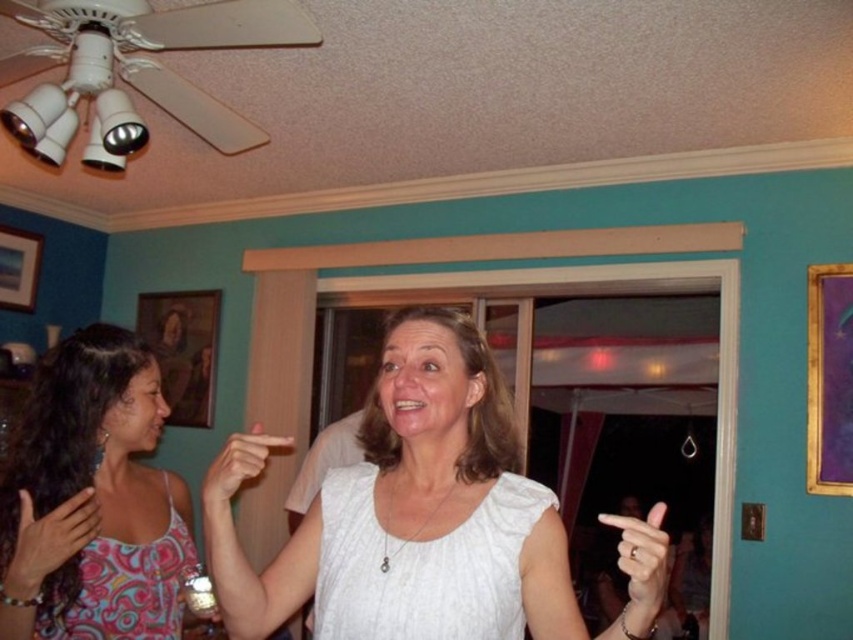
You are a photographer taking a picture of the scene. The subject is wearing a white matte dress at center and has a matte pink hand at lower left. To ensure both the dress and hand are in focus, where should you adjust the camera focus?

The white matte dress at center is located above the matte pink hand at lower left. To ensure both are in focus, focus on the dress since it is closer to the camera, as depth of field typically extends further behind the point of focus than in front.

You are a photographer taking a picture of the white matte dress at center and the matte white hand at center. Which object will appear larger in the photo?

The white matte dress at center will appear larger in the photo because it is bigger than the matte white hand at center.

You are a photographer at a party and want to take a photo of the white matte dress at center and the matte white hand at center. Which object should you focus on first if you want to capture both in sharp focus?

The white matte dress at center is much taller than the matte white hand at center, so you should focus on the white matte dress at center first to ensure both are in sharp focus.